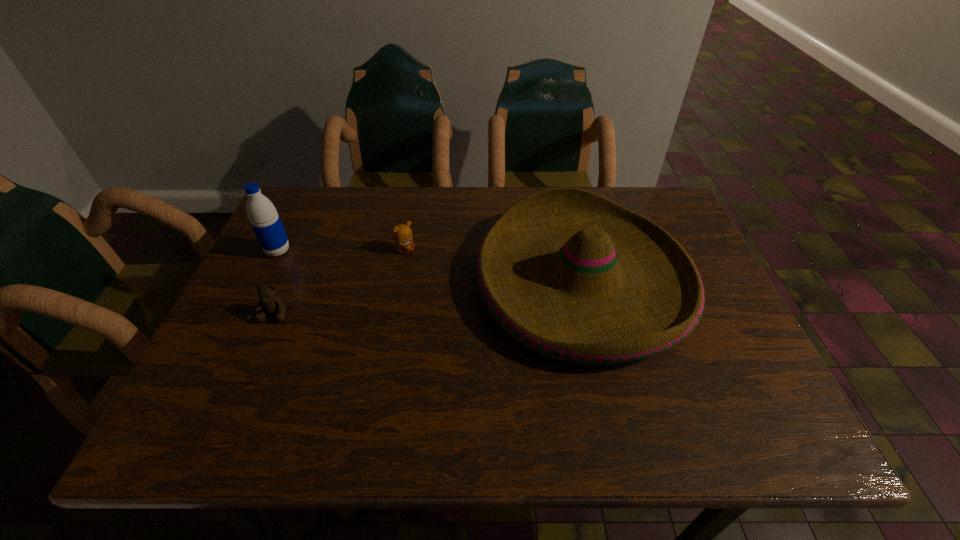
Find the location of a particular element. The height and width of the screenshot is (540, 960). the tallest object is located at coordinates (265, 221).

At what (x,y) coordinates should I click in order to perform the action: click on the rightmost object. Please return your answer as a coordinate pair (x, y). Looking at the image, I should click on (570, 274).

The height and width of the screenshot is (540, 960). I want to click on sombrero, so click(x=570, y=274).

The width and height of the screenshot is (960, 540). I want to click on the third object from left to right, so click(x=401, y=234).

This screenshot has height=540, width=960. In order to click on the farther teddy bear in this screenshot , I will do `click(401, 234)`.

Locate an element on the screen. the left teddy bear is located at coordinates (272, 305).

At what (x,y) coordinates should I click in order to perform the action: click on free space located 0.140m on the front of the water bottle. Please return your answer as a coordinate pair (x, y). Looking at the image, I should click on (254, 300).

Locate an element on the screen. free location located 0.070m on the front of the sombrero is located at coordinates (611, 407).

I want to click on free space located on the face of the second object from right to left, so click(x=558, y=251).

This screenshot has width=960, height=540. Identify the location of free region located 0.250m on the front-facing side of the nearer teddy bear. (225, 430).